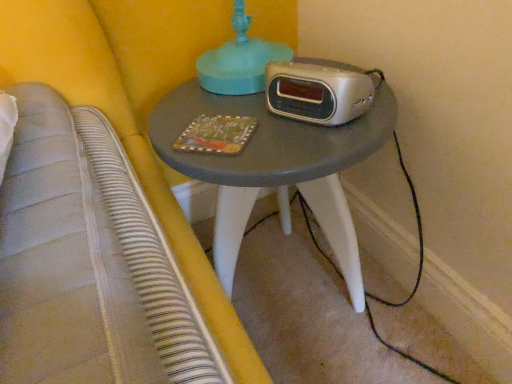
You are a GUI agent. You are given a task and a screenshot of the screen. Output one action in this format:
    pyautogui.click(x=<x>, y=<y>)
    Task: Click on the vacant space in front of silver metallic alarm clock at center
    Image resolution: width=512 pixels, height=384 pixels.
    Given the screenshot: What is the action you would take?
    pyautogui.click(x=305, y=139)